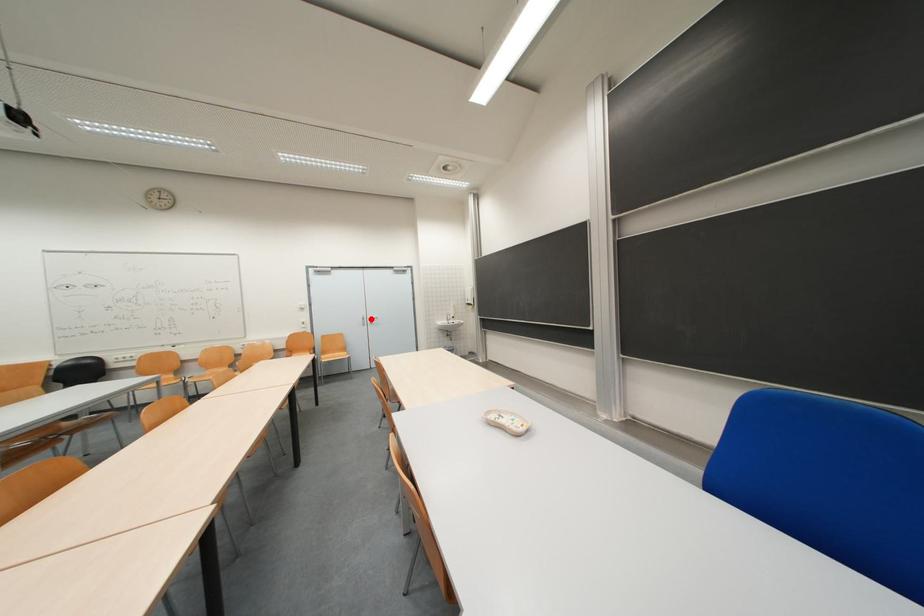
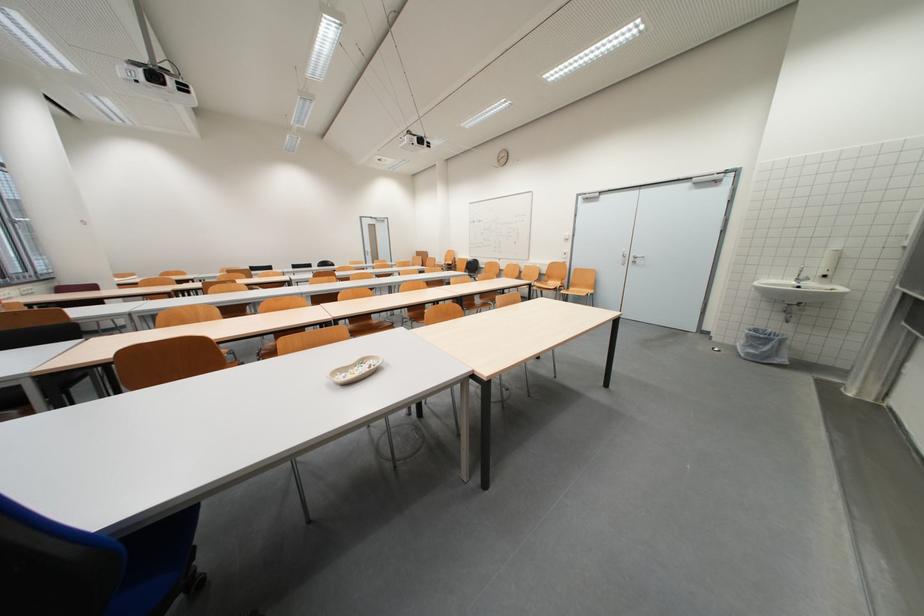
The point at the highlighted location is marked in the first image. Where is the corresponding point in the second image?

(633, 254)